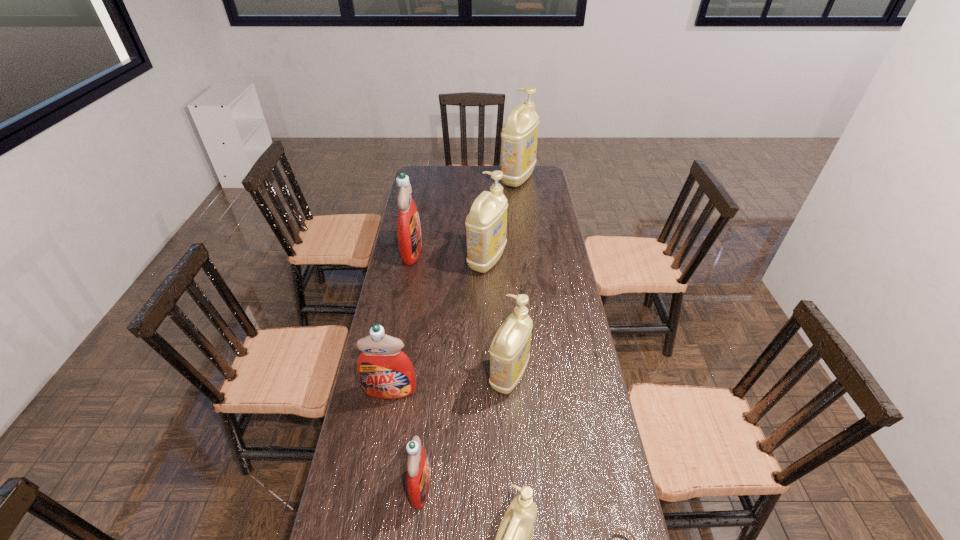
Locate an element on the screen. Image resolution: width=960 pixels, height=540 pixels. the closest detergent to the second nearest beige detergent is located at coordinates (385, 372).

I want to click on detergent identified as the fifth closest to the second biggest red detergent, so click(409, 236).

Locate an element on the screen. Image resolution: width=960 pixels, height=540 pixels. beige detergent that stands as the fourth closest to the watch is located at coordinates (519, 135).

You are a GUI agent. You are given a task and a screenshot of the screen. Output one action in this format:
    pyautogui.click(x=<x>, y=<y>)
    Task: Click on the beige detergent that stands as the closest to the farthest detergent
    The width and height of the screenshot is (960, 540).
    Given the screenshot: What is the action you would take?
    pyautogui.click(x=486, y=224)

Identify which red detergent is located as the third nearest to the second smallest beige detergent. Please provide its 2D coordinates. Your answer should be formatted as a tuple, i.e. [(x, y)], where the tuple contains the x and y coordinates of a point satisfying the conditions above.

[(409, 236)]

You are a GUI agent. You are given a task and a screenshot of the screen. Output one action in this format:
    pyautogui.click(x=<x>, y=<y>)
    Task: Click on the red detergent that is the closest one to the second farthest red detergent
    This screenshot has height=540, width=960.
    Given the screenshot: What is the action you would take?
    pyautogui.click(x=418, y=470)